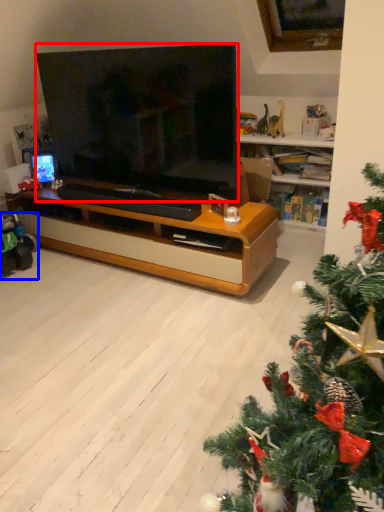
Question: Which of the following is the farthest to the observer, television (highlighted by a red box) or toy (highlighted by a blue box)?

Choices:
 (A) television
 (B) toy

Answer: (B)